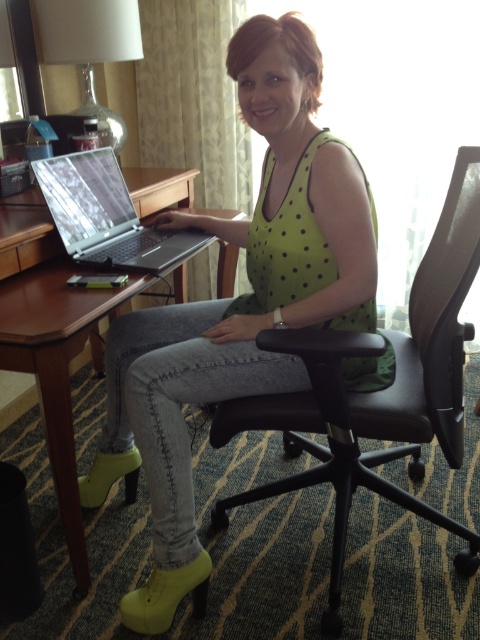
You are a guest in a hotel room and want to sit in the black leather swivel chair at center to use the silver metallic laptop at center. Can you reach the laptop from the chair without moving either?

The black leather swivel chair at center is to the right of the silver metallic laptop at center, so you can reach the laptop from the chair without needing to move either as they are positioned adjacent to each other.

You are a fashion designer observing the woman in the image. You need to determine if the green polka dot tank top at center can be folded and placed inside the brown wood table at left. Based on their sizes, what is your conclusion?

The green polka dot tank top at center is bigger than the brown wood table at left, so it cannot be folded and placed inside the table.

You are a delivery person who needs to place a 18cm tall package on the desk. The package must be placed so that it doesn not block the view of the silver metallic laptop at center. Considering the height of the black leather swivel chair at center, where should you place the package?

The black leather swivel chair at center is taller than the silver metallic laptop at center. To avoid blocking the laptop view, place the package away from the chair, closer to the edge of the desk opposite the chair.